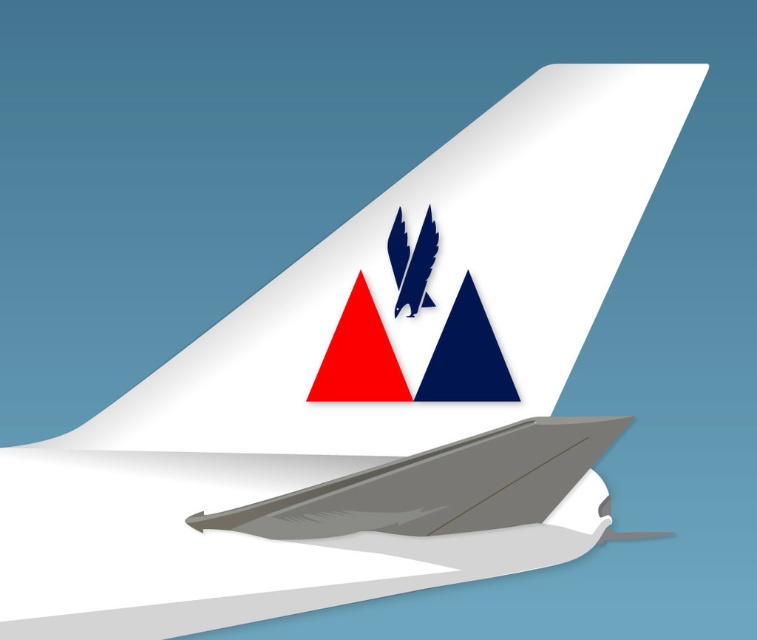
Question: Can you confirm if matte gray winglet at lower center is thinner than navy blue matte triangle at upper center?

Choices:
 (A) no
 (B) yes

Answer: (A)

Question: Which is farther from the matte gray winglet at lower center?

Choices:
 (A) blue glossy eagle at upper center
 (B) red matte triangle at upper center
 (C) navy blue matte triangle at upper center

Answer: (A)

Question: Where is matte gray winglet at lower center located in relation to navy blue matte triangle at upper center in the image?

Choices:
 (A) left
 (B) right

Answer: (A)

Question: From the image, what is the correct spatial relationship of red matte triangle at upper center in relation to blue glossy eagle at upper center?

Choices:
 (A) above
 (B) below

Answer: (B)

Question: Estimate the real-world distances between objects in this image. Which object is closer to the matte gray winglet at lower center?

Choices:
 (A) navy blue matte triangle at upper center
 (B) red matte triangle at upper center
 (C) blue glossy eagle at upper center

Answer: (A)

Question: Which of these objects is positioned farthest from the blue glossy eagle at upper center?

Choices:
 (A) navy blue matte triangle at upper center
 (B) matte gray winglet at lower center
 (C) red matte triangle at upper center

Answer: (B)